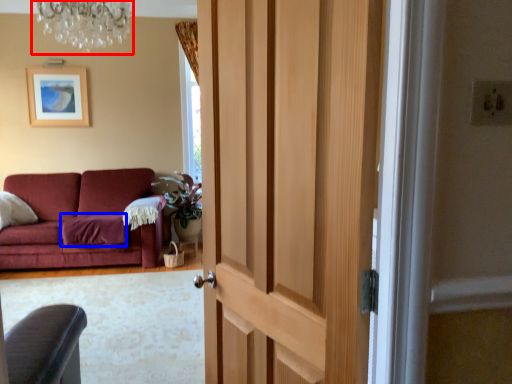
Question: Among these objects, which one is farthest to the camera, light fixture (highlighted by a red box) or blanket (highlighted by a blue box)?

Choices:
 (A) light fixture
 (B) blanket

Answer: (B)